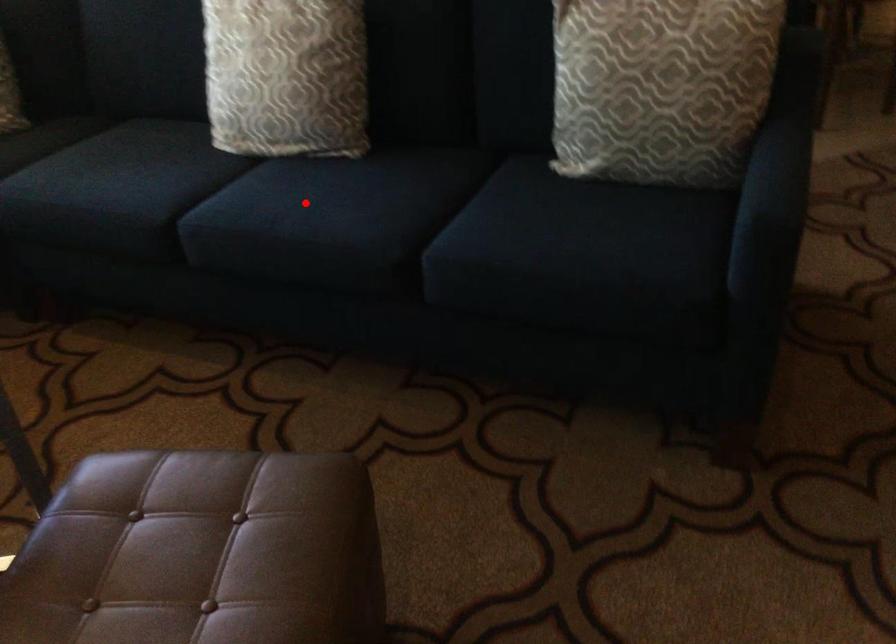
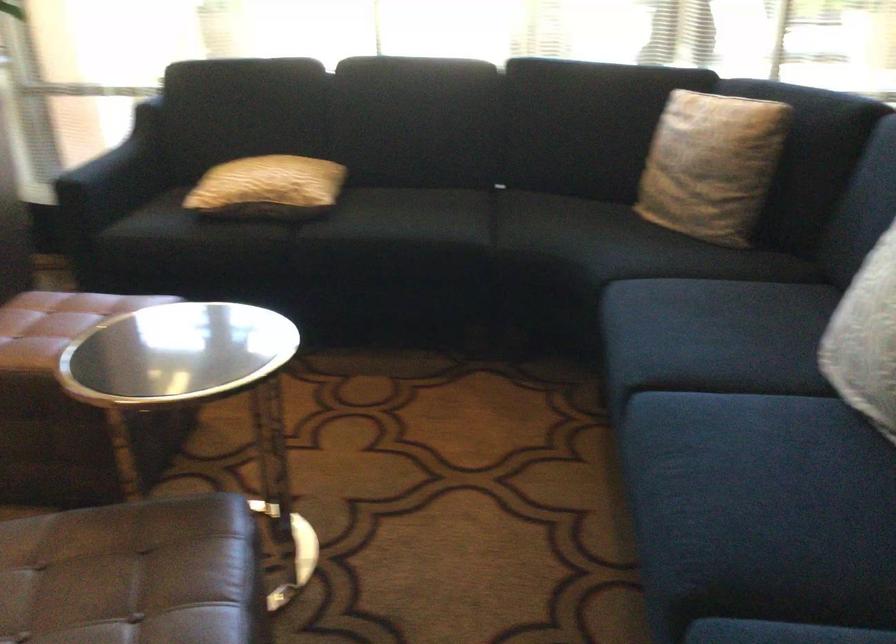
In the second image, find the point that corresponds to the highlighted location in the first image.

(745, 459)